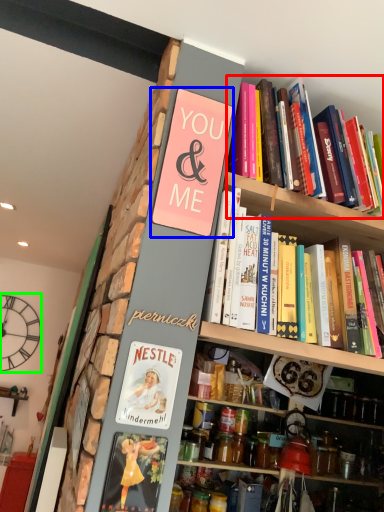
Question: Which is farther away from book (highlighted by a red box)? paperback book (highlighted by a blue box) or clock (highlighted by a green box)?

Choices:
 (A) paperback book
 (B) clock

Answer: (B)